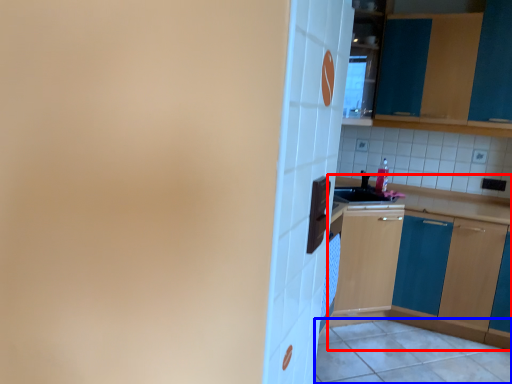
Question: Which point is further to the camera, cabinetry (highlighted by a red box) or tile (highlighted by a blue box)?

Choices:
 (A) cabinetry
 (B) tile

Answer: (A)